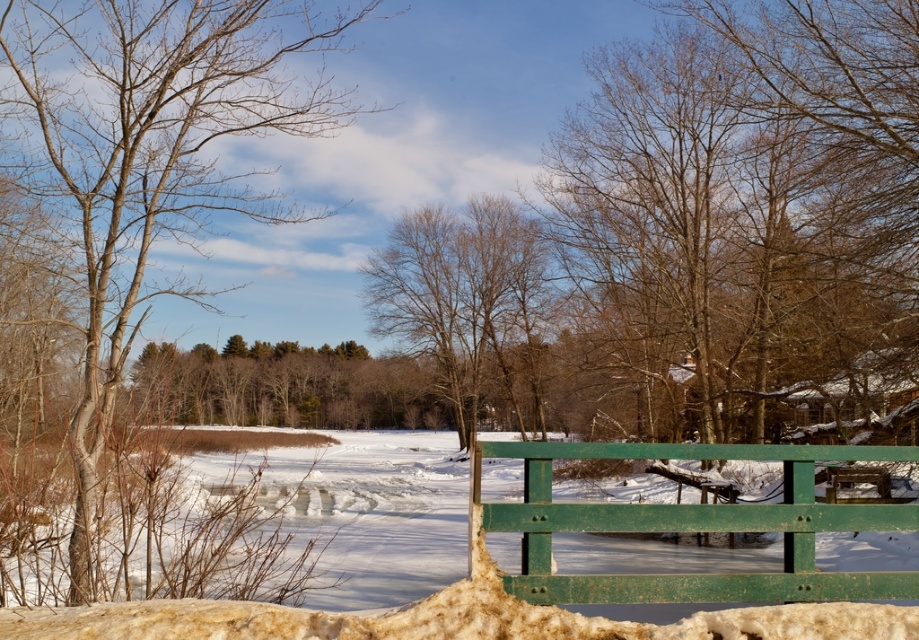
You are standing in the winter landscape and want to walk from the brown bark tree at left to the white fluffy snow at center. Is the path directly between them clear of any obstacles?

The brown bark tree at left is positioned over white fluffy snow at center, so the path between them is clear and there are no obstacles in between.

You are a winter hiker standing near the brown bark tree at left and the white fluffy snow at center. Which object would block your view if you try to look towards the frozen pond in the middle ground?

The brown bark tree at left would block your view because it is larger in size compared to the white fluffy snow at center, making it more likely to obstruct the line of sight towards the frozen pond in the middle ground.

You are standing in a winter landscape and see a green painted wood bench at center. If you want to walk towards it, how many steps would you need to take if each step covers approximately 2.5 feet?

The green painted wood bench at center is 16.77 feet away. Dividing the distance by the step length of 2.5 feet gives approximately 6.7 steps. Since you can only take whole steps, you would need to take 7 steps to reach the bench.